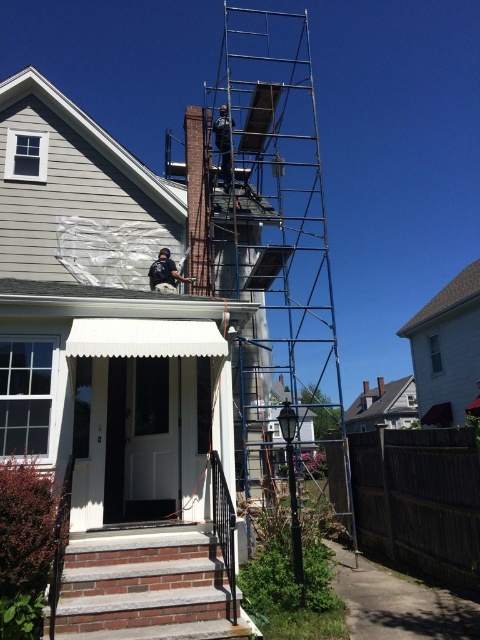
Question: Among these points, which one is farthest from the camera?

Choices:
 (A) (168, 289)
 (B) (223, 582)
 (C) (289, 220)

Answer: (C)

Question: In this image, where is metallic scaffolding at center located relative to brick stairs at lower left?

Choices:
 (A) below
 (B) above

Answer: (B)

Question: Is metallic scaffolding at center wider than brick stairs at lower left?

Choices:
 (A) yes
 (B) no

Answer: (A)

Question: Which object is the closest to the brick stairs at lower left?

Choices:
 (A) metallic scaffolding at center
 (B) black fabric construction worker at center

Answer: (B)

Question: Which point appears farthest from the camera in this image?

Choices:
 (A) (310, 317)
 (B) (216, 592)
 (C) (154, 268)

Answer: (A)

Question: Does metallic scaffolding at center have a greater width compared to black fabric construction worker at center?

Choices:
 (A) yes
 (B) no

Answer: (A)